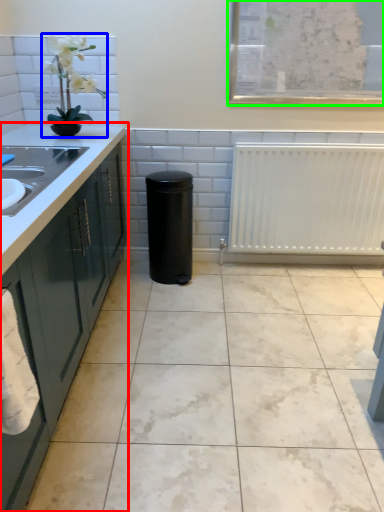
Question: Which object is the closest to the countertop (highlighted by a red box)? Choose among these: houseplant (highlighted by a blue box) or window screen (highlighted by a green box).

Choices:
 (A) houseplant
 (B) window screen

Answer: (A)